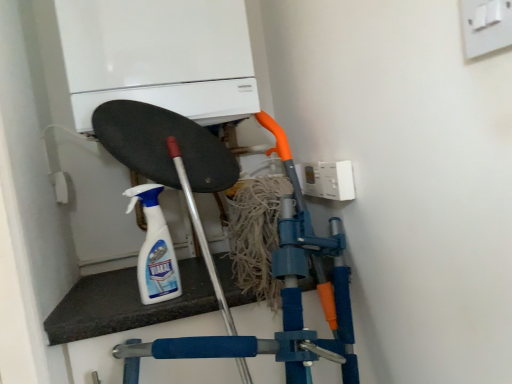
Question: Considering the relative positions of white plastic spray bottle at center and white plastic electric outlet at upper right, which appears as the first electric outlet when ordered from the bottom, in the image provided, is white plastic spray bottle at center to the left or to the right of white plastic electric outlet at upper right, which appears as the first electric outlet when ordered from the bottom,?

Choices:
 (A) left
 (B) right

Answer: (A)

Question: Is white plastic spray bottle at center inside or outside of white plastic electric outlet at upper right, which appears as the first electric outlet when ordered from the bottom?

Choices:
 (A) inside
 (B) outside

Answer: (B)

Question: Which is farther from the white matte boiler at upper center?

Choices:
 (A) white plastic switch at upper right, the second electric outlet positioned from the left
 (B) white plastic spray bottle at center
 (C) white plastic electric outlet at upper right, the first electric outlet viewed from the back
 (D) blue rubber vacuum at center

Answer: (A)

Question: Which object is the closest to the white plastic spray bottle at center?

Choices:
 (A) white plastic electric outlet at upper right, which is the 2th electric outlet from top to bottom
 (B) white plastic switch at upper right, marked as the second electric outlet in a bottom-to-top arrangement
 (C) blue rubber vacuum at center
 (D) white matte boiler at upper center

Answer: (C)